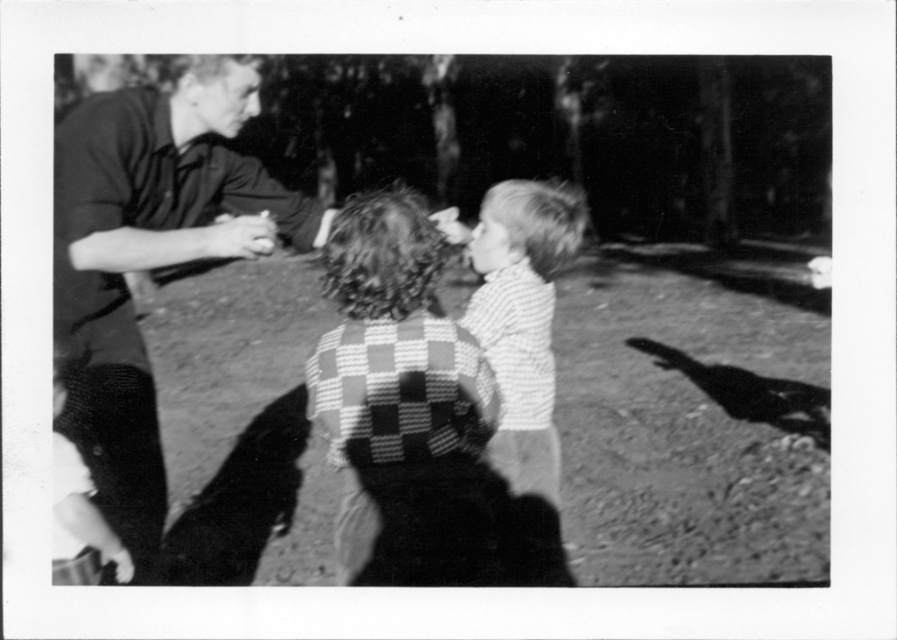
Question: Which point is closer to the camera?

Choices:
 (A) smooth dark shirt at left
 (B) checkered fabric sweater at center
 (C) striped cotton shirt at center

Answer: (B)

Question: Among these objects, which one is farthest from the camera?

Choices:
 (A) smooth skin hand at center
 (B) striped cotton shirt at center
 (C) smooth dark shirt at left

Answer: (B)

Question: Which object appears farthest from the camera in this image?

Choices:
 (A) smooth skin hand at center
 (B) checkered fabric sweater at center

Answer: (A)

Question: Can you confirm if smooth dark shirt at left is smaller than striped cotton shirt at center?

Choices:
 (A) yes
 (B) no

Answer: (B)

Question: Considering the relative positions of checkered fabric sweater at center and smooth skin hand at center in the image provided, where is checkered fabric sweater at center located with respect to smooth skin hand at center?

Choices:
 (A) below
 (B) above

Answer: (A)

Question: Does smooth dark shirt at left come behind smooth skin hand at center?

Choices:
 (A) yes
 (B) no

Answer: (B)